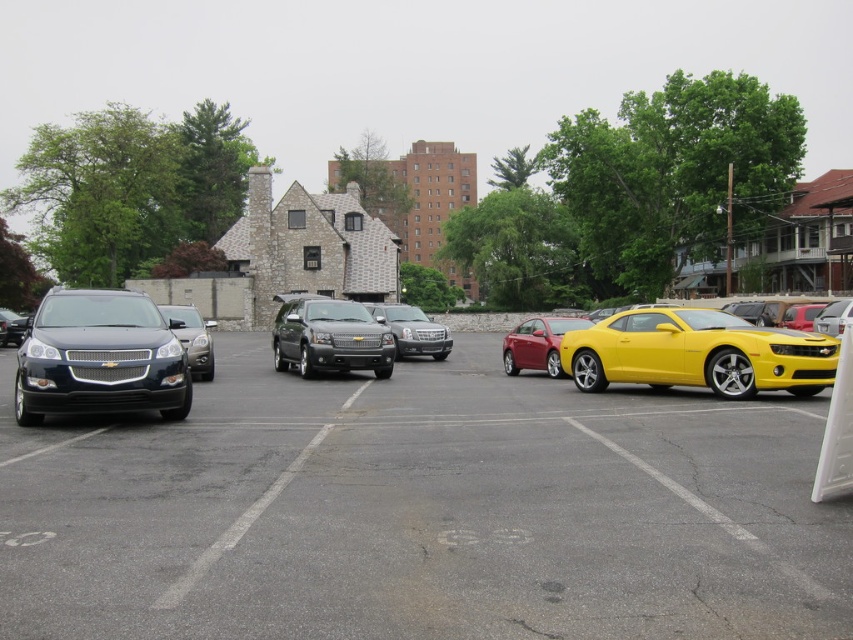
You are standing at the center of the parking lot and see the point marked at coordinates (99, 356). Which vehicle is located at that point?

The point at coordinates (99, 356) corresponds to the matte black suv at left.

Where is the satin black sedan at center located in the image?

The satin black sedan at center is located at point coordinates of (192, 337).